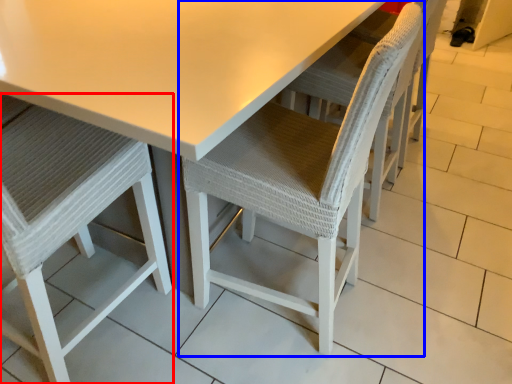
Question: Among these objects, which one is farthest to the camera, chair (highlighted by a red box) or chair (highlighted by a blue box)?

Choices:
 (A) chair
 (B) chair

Answer: (B)